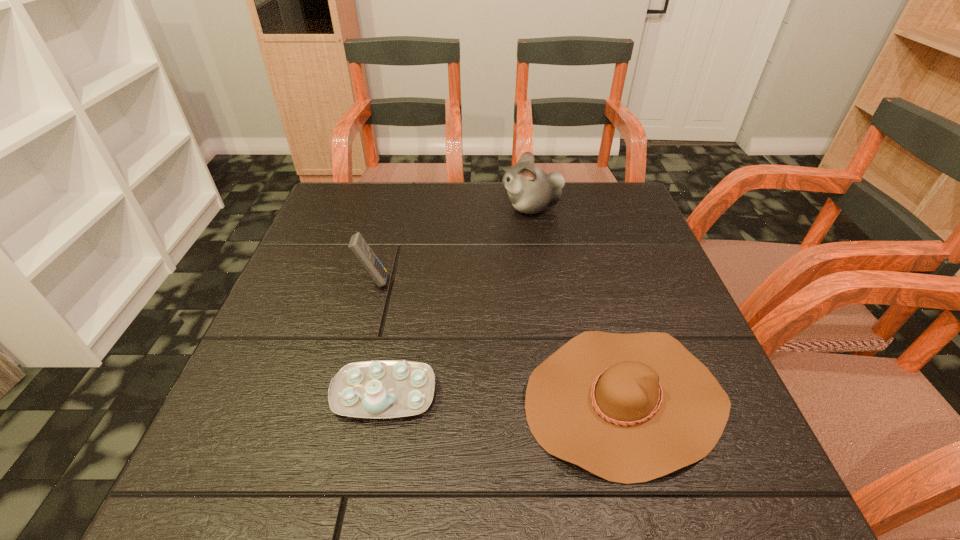
Find the location of `unoccupied area between the cowboy hat and the third nearest object`. unoccupied area between the cowboy hat and the third nearest object is located at coordinates (499, 340).

Where is `vacant space that's between the farthest object and the calculator`? vacant space that's between the farthest object and the calculator is located at coordinates (452, 244).

At what (x,y) coordinates should I click in order to perform the action: click on unoccupied position between the cowboy hat and the chinaware. Please return your answer as a coordinate pair (x, y). The width and height of the screenshot is (960, 540). Looking at the image, I should click on click(x=504, y=396).

At what (x,y) coordinates should I click in order to perform the action: click on object that is the third closest to the chinaware. Please return your answer as a coordinate pair (x, y). The width and height of the screenshot is (960, 540). Looking at the image, I should click on (531, 190).

Where is `the third closest object to the cowboy hat`? the third closest object to the cowboy hat is located at coordinates (531, 190).

You are a GUI agent. You are given a task and a screenshot of the screen. Output one action in this format:
    pyautogui.click(x=<x>, y=<y>)
    Task: Click on the vacant space that satisfies the following two spatial constraints: 1. on the back side of the cowboy hat; 2. on the face of the farthest object
    The height and width of the screenshot is (540, 960).
    Given the screenshot: What is the action you would take?
    point(571,207)

Where is `vacant region that satisfies the following two spatial constraints: 1. on the back side of the cowboy hat; 2. on the front-facing side of the second tallest object`? This screenshot has height=540, width=960. vacant region that satisfies the following two spatial constraints: 1. on the back side of the cowboy hat; 2. on the front-facing side of the second tallest object is located at coordinates (591, 281).

You are a GUI agent. You are given a task and a screenshot of the screen. Output one action in this format:
    pyautogui.click(x=<x>, y=<y>)
    Task: Click on the vacant area that satisfies the following two spatial constraints: 1. on the front-facing side of the third shortest object; 2. on the right side of the shortest object
    The height and width of the screenshot is (540, 960).
    Given the screenshot: What is the action you would take?
    pyautogui.click(x=342, y=399)

Find the location of a particular element. free region that satisfies the following two spatial constraints: 1. on the front-facing side of the calculator; 2. on the left side of the cowboy hat is located at coordinates (342, 399).

At what (x,y) coordinates should I click in order to perform the action: click on vacant space that satisfies the following two spatial constraints: 1. on the front-facing side of the calculator; 2. on the left side of the cowboy hat. Please return your answer as a coordinate pair (x, y). The width and height of the screenshot is (960, 540). Looking at the image, I should click on (342, 399).